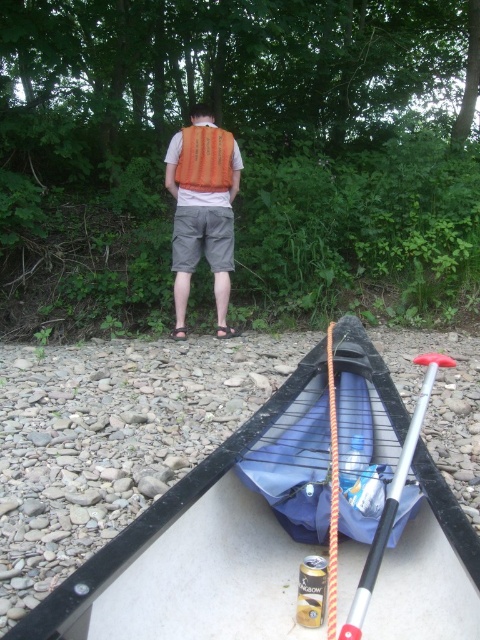
Question: Considering the relative positions of orange fabric life vest at center and silver metallic paddle at lower right in the image provided, where is orange fabric life vest at center located with respect to silver metallic paddle at lower right?

Choices:
 (A) left
 (B) right

Answer: (A)

Question: Among these objects, which one is farthest from the camera?

Choices:
 (A) orange fabric life vest at center
 (B) black plastic boat at lower center
 (C) silver metallic paddle at lower right

Answer: (A)

Question: Which object is farther from the camera taking this photo?

Choices:
 (A) silver metallic paddle at lower right
 (B) black plastic boat at lower center
 (C) orange fabric life vest at center

Answer: (C)

Question: Can you confirm if orange fabric life vest at center is thinner than silver metallic paddle at lower right?

Choices:
 (A) yes
 (B) no

Answer: (B)

Question: Which object is closer to the camera taking this photo?

Choices:
 (A) silver metallic paddle at lower right
 (B) black plastic boat at lower center
 (C) orange fabric life vest at center

Answer: (A)

Question: Can you confirm if black plastic boat at lower center is positioned to the left of silver metallic paddle at lower right?

Choices:
 (A) yes
 (B) no

Answer: (A)